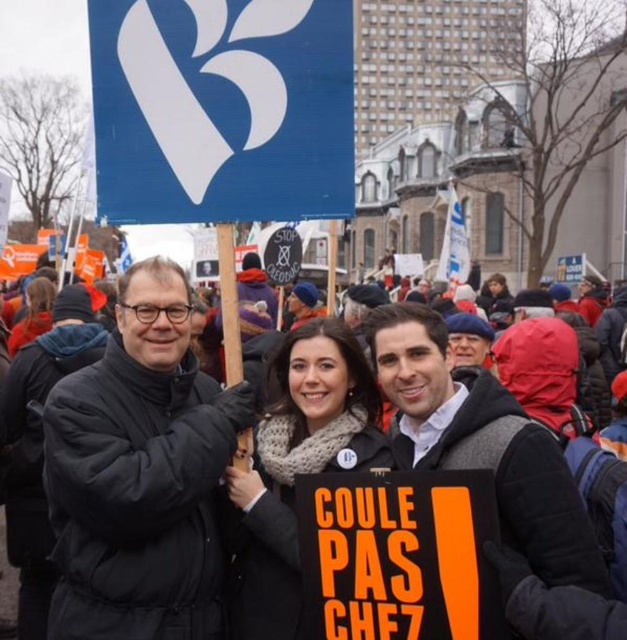
You are a photographer trying to capture a photo of the orange paper placard at center and the knitted scarf at center in the same frame. Given that your camera has a focal length of 50mm and the minimum distance between objects in the frame must be at least 6 meters to avoid blurring, will you be able to achieve this shot?

The distance between the orange paper placard at center and the knitted scarf at center is 5.64 meters, which is less than the required 6 meters. Therefore, the photographer cannot capture both in the same frame without blurring.